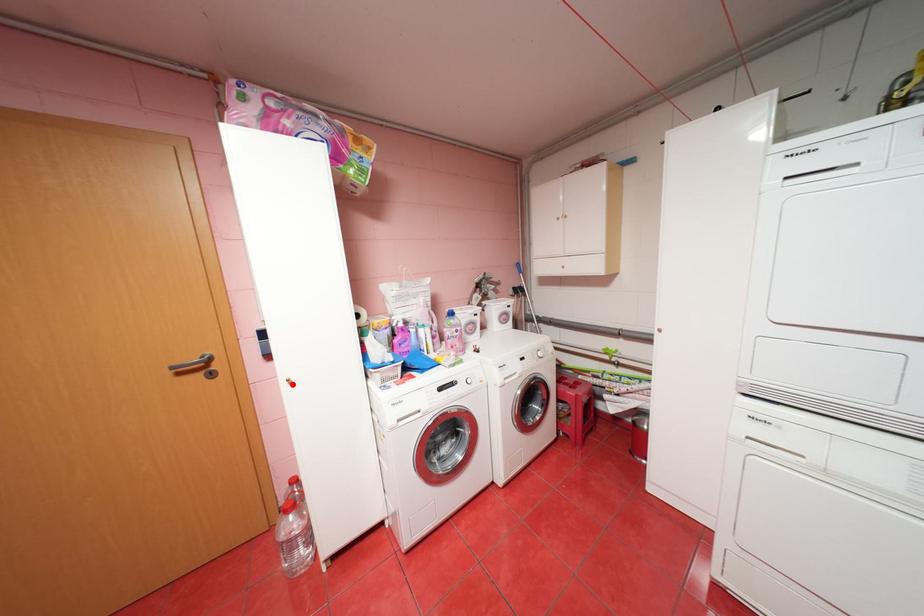
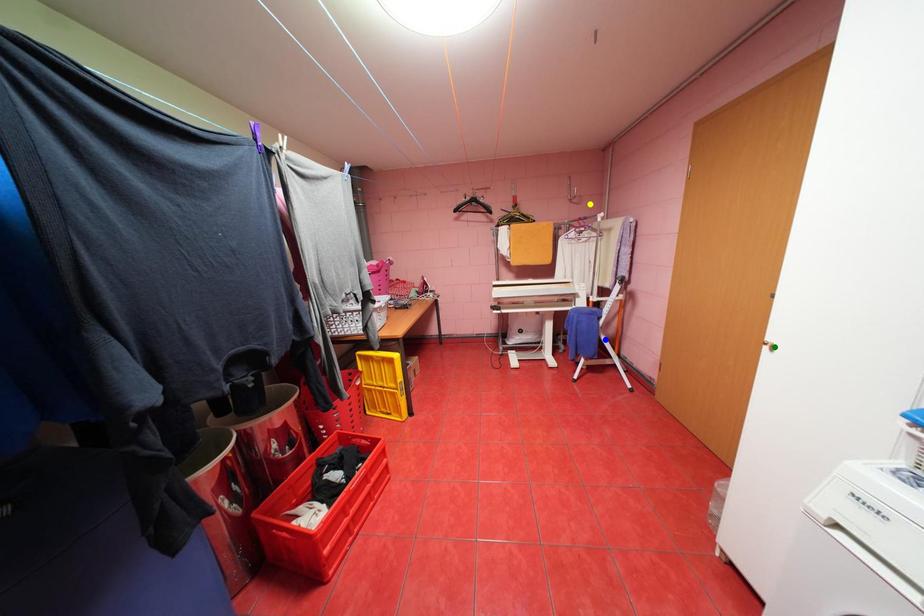
Question: I am providing you with two images of the same scene from different viewpoints. A red point is marked on the first image. You are given multiple points on the second image. Which point in image 2 is actually the same real-world point as the red point in image 1?

Choices:
 (A) blue point
 (B) green point
 (C) yellow point

Answer: (B)